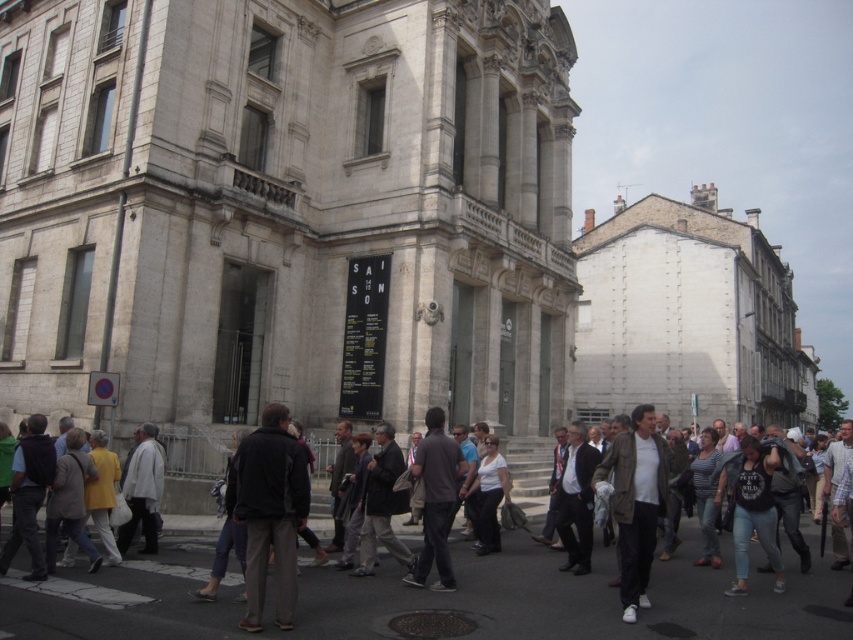
You are a photographer trying to capture a clear shot of the classical building in the background. However, there are two people blocking your view at the center of the frame. The dark gray pants at center and the light yellow jacket at center are in your way. Which person should you ask to step aside so you can see the building better?

You should ask the dark gray pants at center to step aside first because they are in front of the light yellow jacket at center, blocking more of your view.

You are standing at the point closer to the building in the urban scene. There are two points marked on the ground in front of you. One is labeled as point (285, 502) and the other as point (15, 536). Which point is closer to you?

Point (285, 502) is in front of point (15, 536), so it is closer to you.